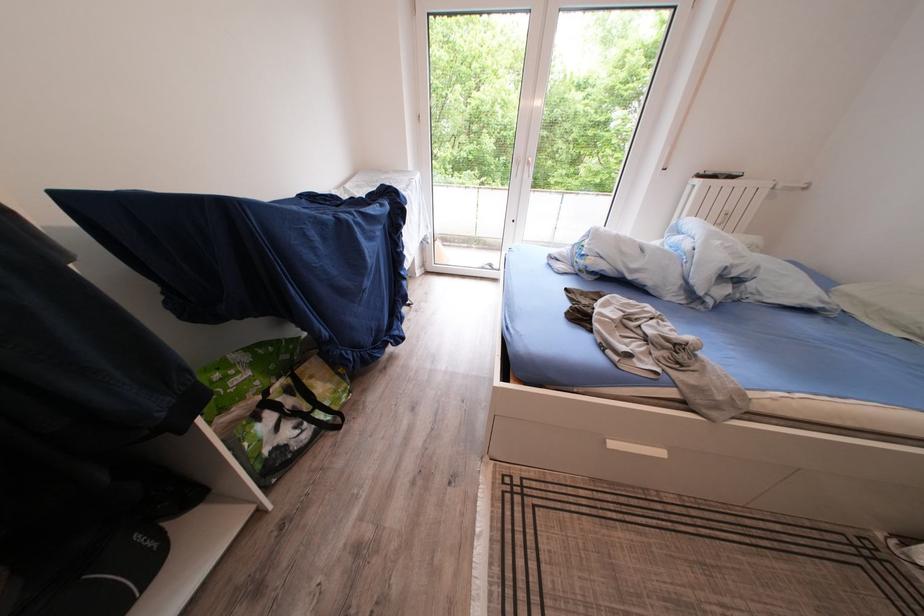
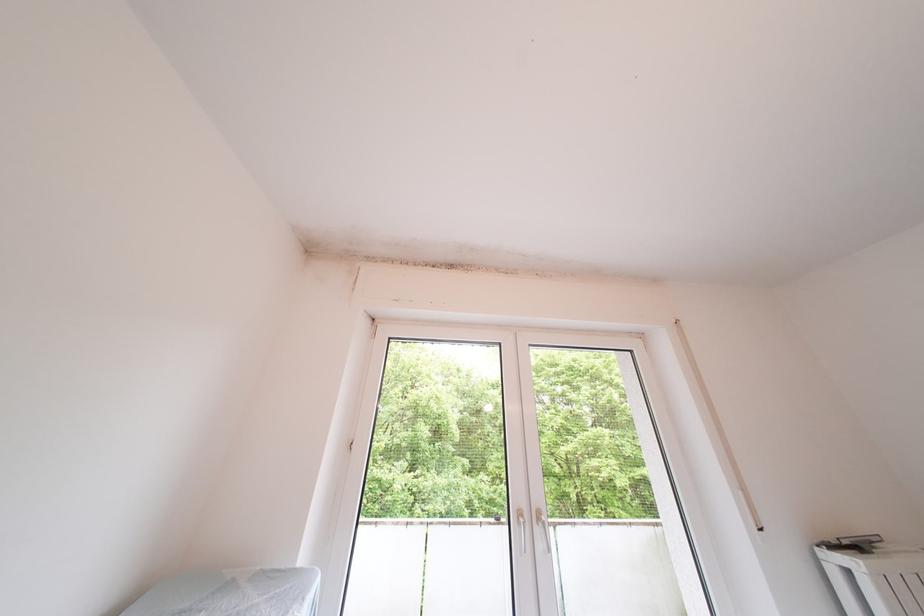
The point at (x=535, y=180) is marked in the first image. Where is the corresponding point in the second image?

(550, 552)